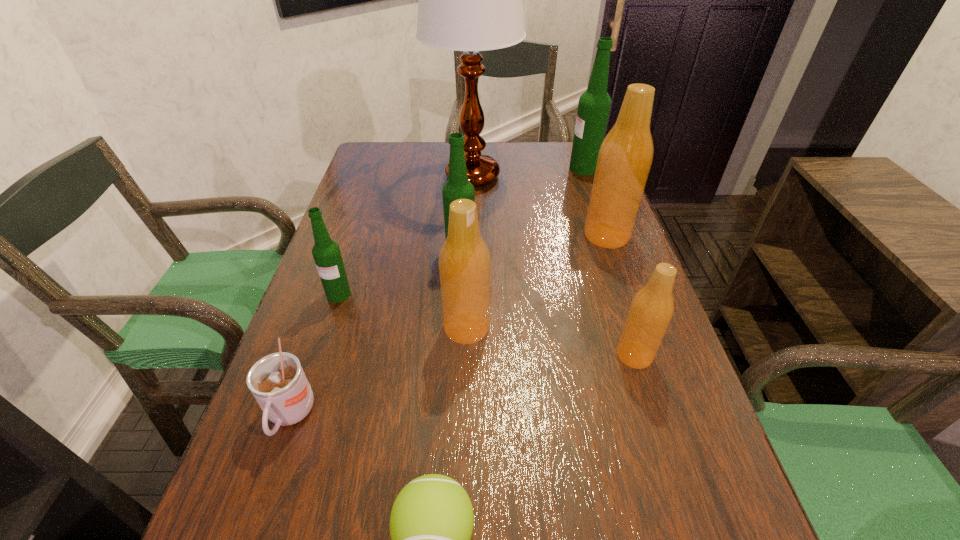
Image resolution: width=960 pixels, height=540 pixels. I want to click on beer bottle that is the fifth closest to the smallest tan beer bottle, so click(594, 105).

Select which beer bottle is the closest to the green tennis ball. Please provide its 2D coordinates. Your answer should be formatted as a tuple, i.e. [(x, y)], where the tuple contains the x and y coordinates of a point satisfying the conditions above.

[(464, 261)]

Choose which green beer bottle is the nearest neighbor to the second nearest green beer bottle. Please provide its 2D coordinates. Your answer should be formatted as a tuple, i.e. [(x, y)], where the tuple contains the x and y coordinates of a point satisfying the conditions above.

[(326, 253)]

Identify the location of green beer bottle that is the second closest to the nearest green beer bottle. (594, 105).

I want to click on tan beer bottle that is the second closest to the leftmost green beer bottle, so click(652, 307).

You are a GUI agent. You are given a task and a screenshot of the screen. Output one action in this format:
    pyautogui.click(x=<x>, y=<y>)
    Task: Click on the tan beer bottle that is the second nearest to the third nearest beer bottle
    The height and width of the screenshot is (540, 960).
    Given the screenshot: What is the action you would take?
    tap(652, 307)

The height and width of the screenshot is (540, 960). Find the location of `free space that satisfies the following two spatial constraints: 1. on the label of the smallest tan beer bottle; 2. on the right side of the fourth farthest beer bottle`. free space that satisfies the following two spatial constraints: 1. on the label of the smallest tan beer bottle; 2. on the right side of the fourth farthest beer bottle is located at coordinates (319, 355).

Where is `free space that satisfies the following two spatial constraints: 1. on the label of the farthest beer bottle; 2. on the front side of the leftmost tan beer bottle`? The image size is (960, 540). free space that satisfies the following two spatial constraints: 1. on the label of the farthest beer bottle; 2. on the front side of the leftmost tan beer bottle is located at coordinates (638, 328).